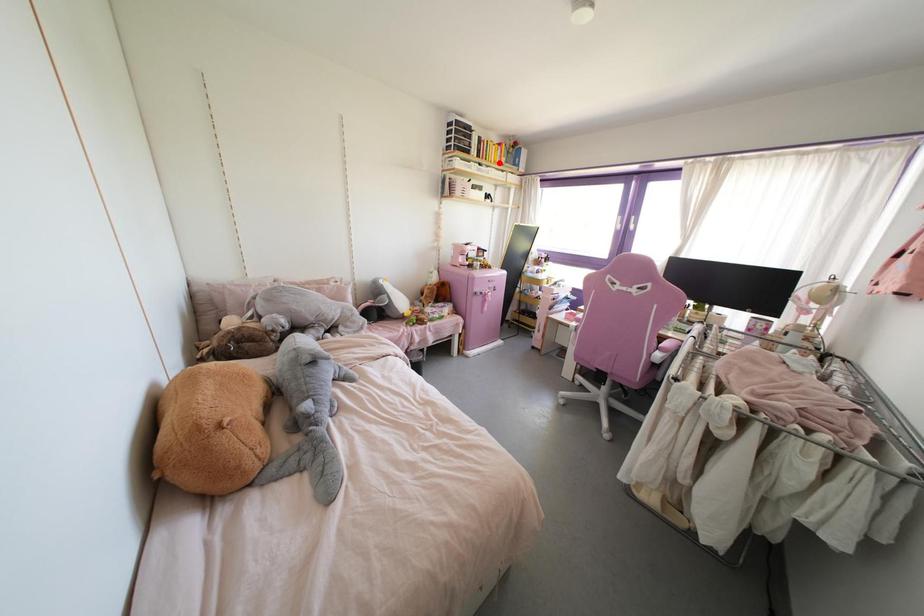
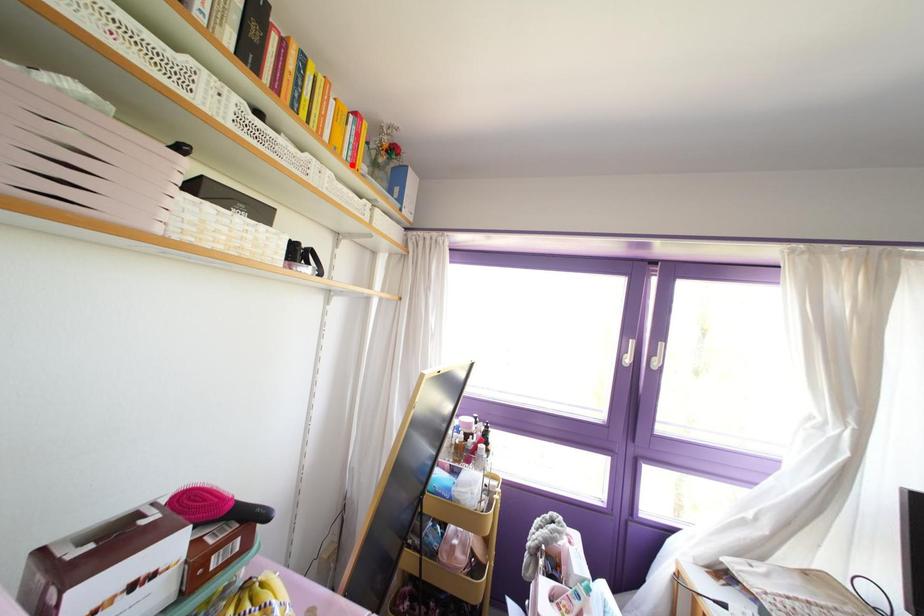
I am providing you with two images of the same scene from different viewpoints. A red point is marked on the first image and another point is marked on the second image. Does the point marked in image1 correspond to the same location as the one in image2?

Yes